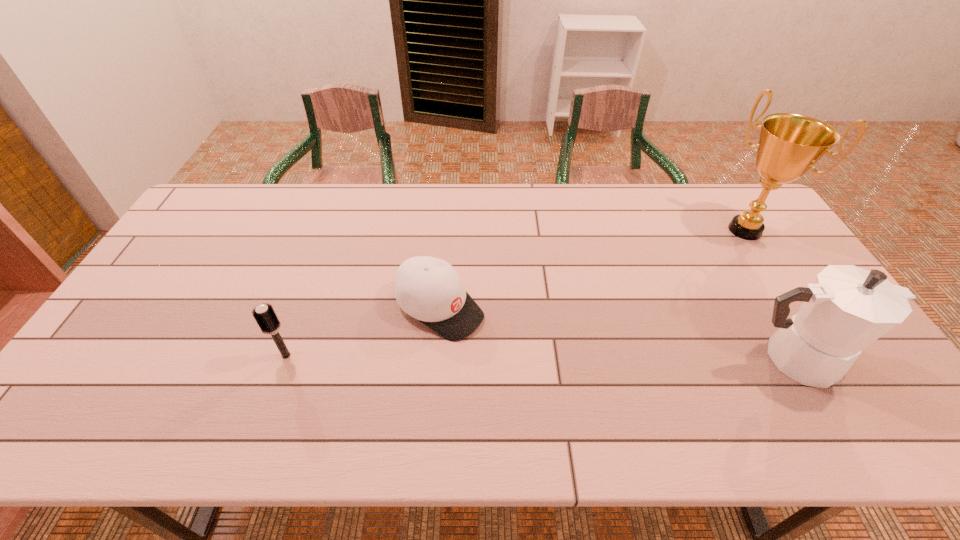
The width and height of the screenshot is (960, 540). What are the coordinates of `the leftmost object` in the screenshot? It's located at (265, 316).

Where is `the third tallest object`? The width and height of the screenshot is (960, 540). the third tallest object is located at coordinates (265, 316).

Identify the location of coffeepot. This screenshot has height=540, width=960. (847, 308).

Locate an element on the screen. the tallest object is located at coordinates (790, 144).

You are a GUI agent. You are given a task and a screenshot of the screen. Output one action in this format:
    pyautogui.click(x=<x>, y=<y>)
    Task: Click on the farthest object
    The height and width of the screenshot is (540, 960).
    Given the screenshot: What is the action you would take?
    pyautogui.click(x=790, y=144)

The width and height of the screenshot is (960, 540). What are the coordinates of `baseball cap` in the screenshot? It's located at (429, 289).

This screenshot has height=540, width=960. Identify the location of the shortest object. (429, 289).

You are a GUI agent. You are given a task and a screenshot of the screen. Output one action in this format:
    pyautogui.click(x=<x>, y=<y>)
    Task: Click on the vacant region located 0.050m on the left of the hairbrush
    Image resolution: width=960 pixels, height=540 pixels.
    Given the screenshot: What is the action you would take?
    pyautogui.click(x=257, y=355)

The width and height of the screenshot is (960, 540). I want to click on free space located 0.070m on the front view with handles of the tallest object, so point(720,254).

I want to click on blank area located on the front view with handles of the tallest object, so coord(717,256).